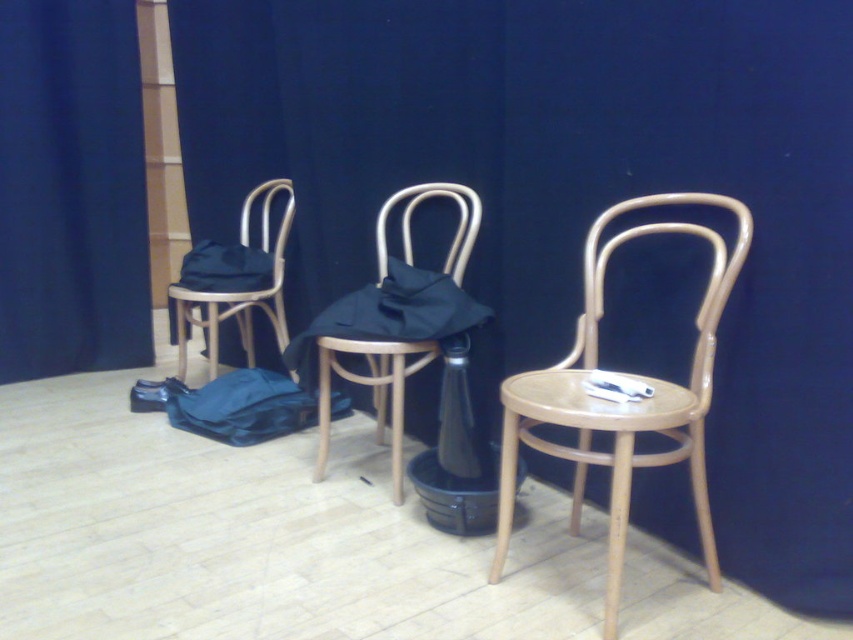
Question: Among these points, which one is nearest to the camera?

Choices:
 (A) (456, 339)
 (B) (18, 234)
 (C) (370, 371)
 (D) (276, 324)

Answer: (A)

Question: Observing the image, what is the correct spatial positioning of matte wood chair at left in reference to black plastic bottle at center?

Choices:
 (A) left
 (B) right

Answer: (A)

Question: Which object appears farthest from the camera in this image?

Choices:
 (A) black plastic bottle at center
 (B) blue fabric curtain at left
 (C) matte wood chair at left

Answer: (B)

Question: Which of the following is the farthest from the observer?

Choices:
 (A) wooden chair at center
 (B) blue fabric bag at center

Answer: (B)

Question: Can you confirm if blue fabric bag at center is positioned to the left of matte wood chair at left?

Choices:
 (A) yes
 (B) no

Answer: (B)

Question: Is blue fabric bag at center behind black plastic bottle at center?

Choices:
 (A) no
 (B) yes

Answer: (B)